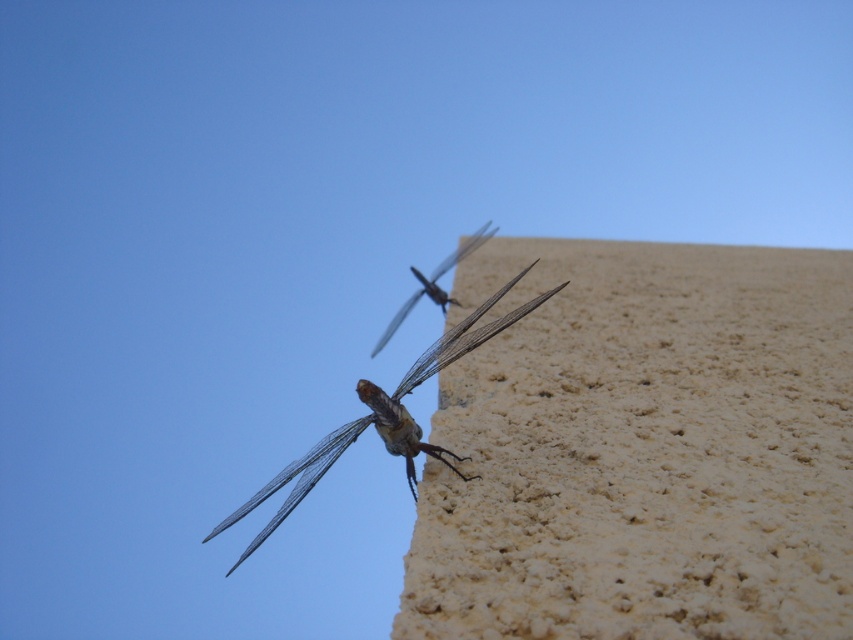
You are an entomologist observing two insects at a nature reserve. You see a translucent glass dragonfly at upper center and a translucent winged insect at upper center. Which one is closer to the blue sky in the background?

The translucent glass dragonfly at upper center and the translucent winged insect at upper center are both at the same position at upper center, so they are equally close to the blue sky in the background.

You are an architect designing a garden and want to place a dragonfly statue at the exact location of the point in the image. The dragonfly in the image is at point [296,483]. The dragonfly statue is 1.2 meters tall. The dragonfly in the image is 0.3 meters tall. Will the statue be taller than the dragonfly in the image?

The dragonfly statue is 1.2 meters tall, which is taller than the dragonfly in the image at point [296,483] that is 0.3 meters tall. Therefore, the statue will be taller.